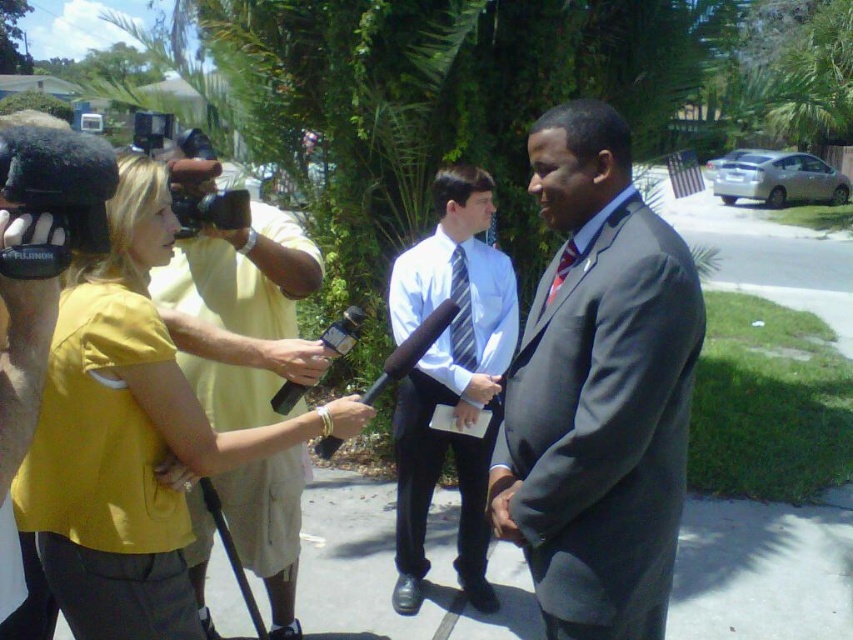
You are a photographer standing in the scene and want to take a photo of both the point at [498,285] and the point at [456,262]. Which point will appear closer to the camera in the photo?

Point [498,285] is further to the viewer than point [456,262], so in the photo, the point at [456,262] will appear closer to the camera.